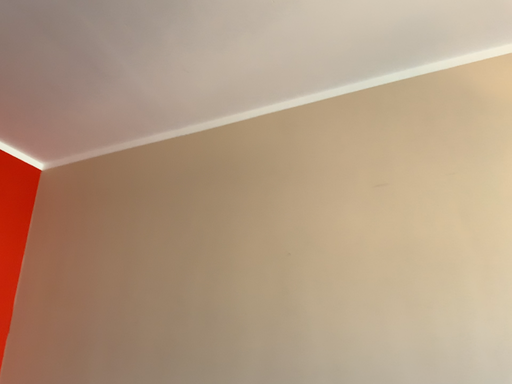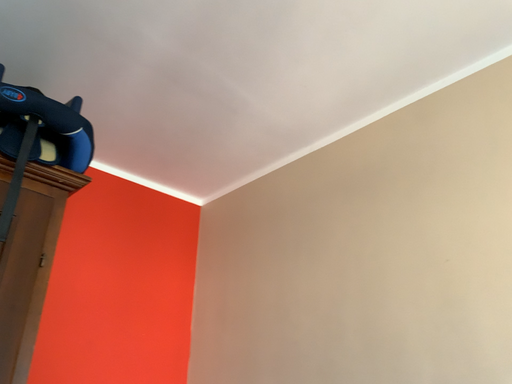
Question: How did the camera likely rotate when shooting the video?

Choices:
 (A) rotated left
 (B) rotated right

Answer: (A)